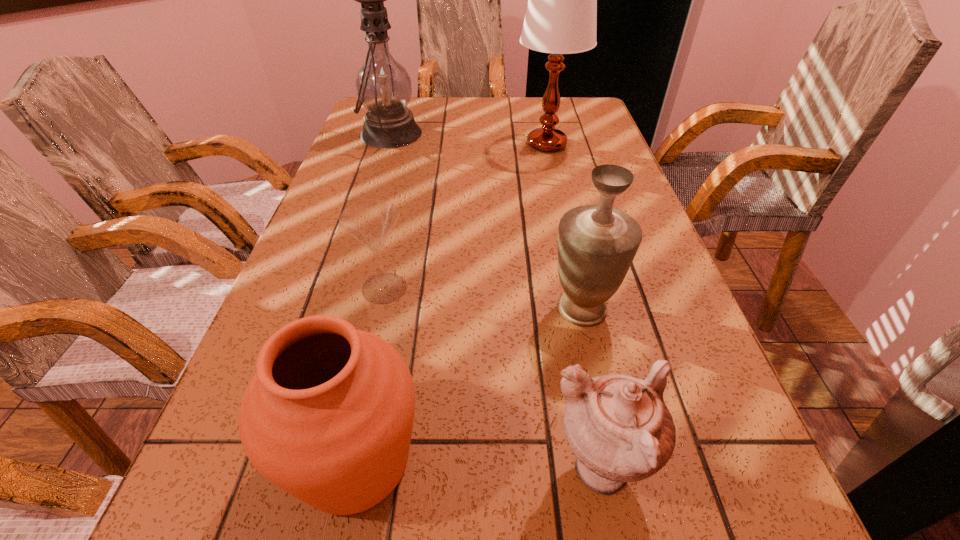
Find the location of `vacant space at the right edge`. vacant space at the right edge is located at coordinates (647, 288).

Where is `vacant space that's between the table lamp and the leftmost urn`? The height and width of the screenshot is (540, 960). vacant space that's between the table lamp and the leftmost urn is located at coordinates (451, 302).

The height and width of the screenshot is (540, 960). I want to click on free space between the second shortest object and the shortest object, so [492, 380].

You are a GUI agent. You are given a task and a screenshot of the screen. Output one action in this format:
    pyautogui.click(x=<x>, y=<y>)
    Task: Click on the free point between the farthest urn and the shortest object
    This screenshot has width=960, height=540.
    Given the screenshot: What is the action you would take?
    pyautogui.click(x=483, y=298)

Where is `free spot between the shortest urn and the oil lamp`? free spot between the shortest urn and the oil lamp is located at coordinates (494, 303).

Image resolution: width=960 pixels, height=540 pixels. Find the location of `free spot between the oil lamp and the table lamp`. free spot between the oil lamp and the table lamp is located at coordinates (468, 139).

The height and width of the screenshot is (540, 960). Identify the location of free spot between the table lamp and the shortest object. (466, 216).

Choose which object is the fourth nearest neighbor to the flute glass. Please provide its 2D coordinates. Your answer should be formatted as a tuple, i.e. [(x, y)], where the tuple contains the x and y coordinates of a point satisfying the conditions above.

[(383, 85)]

Identify which object is the fifth closest to the leftmost urn. Please provide its 2D coordinates. Your answer should be formatted as a tuple, i.e. [(x, y)], where the tuple contains the x and y coordinates of a point satisfying the conditions above.

[(383, 85)]

I want to click on urn that is the third nearest to the table lamp, so click(x=619, y=427).